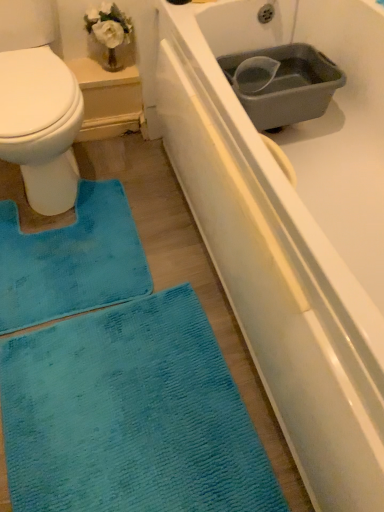
Question: Is blue textured mat at lower left surrounded by gray plastic basin at upper right?

Choices:
 (A) no
 (B) yes

Answer: (A)

Question: Is gray plastic basin at upper right oriented away from blue textured mat at lower left?

Choices:
 (A) yes
 (B) no

Answer: (B)

Question: Is gray plastic basin at upper right smaller than blue textured mat at lower left?

Choices:
 (A) no
 (B) yes

Answer: (A)

Question: From the image's perspective, would you say gray plastic basin at upper right is positioned over blue textured mat at lower left?

Choices:
 (A) yes
 (B) no

Answer: (A)

Question: Is gray plastic basin at upper right wider than blue textured mat at lower left?

Choices:
 (A) yes
 (B) no

Answer: (B)

Question: In terms of width, does blue textured mat at lower left look wider or thinner when compared to gray plastic basin at upper right?

Choices:
 (A) wide
 (B) thin

Answer: (A)

Question: Relative to gray plastic basin at upper right, is blue textured mat at lower left in front or behind?

Choices:
 (A) behind
 (B) front

Answer: (B)

Question: Considering the positions of point (147, 274) and point (327, 69), is point (147, 274) closer or farther from the camera than point (327, 69)?

Choices:
 (A) closer
 (B) farther

Answer: (A)

Question: Considering the positions of blue textured mat at lower left and gray plastic basin at upper right in the image, is blue textured mat at lower left bigger or smaller than gray plastic basin at upper right?

Choices:
 (A) small
 (B) big

Answer: (A)

Question: From the image's perspective, is white matte bathtub at center above or below gray plastic basin at upper right?

Choices:
 (A) above
 (B) below

Answer: (B)

Question: Is point (375, 412) positioned closer to the camera than point (296, 110)?

Choices:
 (A) closer
 (B) farther

Answer: (A)

Question: From a real-world perspective, relative to gray plastic basin at upper right, is white matte bathtub at center vertically above or below?

Choices:
 (A) above
 (B) below

Answer: (B)

Question: In the image, is white matte bathtub at center positioned in front of or behind gray plastic basin at upper right?

Choices:
 (A) front
 (B) behind

Answer: (A)

Question: Is teal soft rug at lower left in front of or behind white matte bathtub at center in the image?

Choices:
 (A) behind
 (B) front

Answer: (A)

Question: From their relative heights in the image, would you say teal soft rug at lower left is taller or shorter than white matte bathtub at center?

Choices:
 (A) short
 (B) tall

Answer: (B)